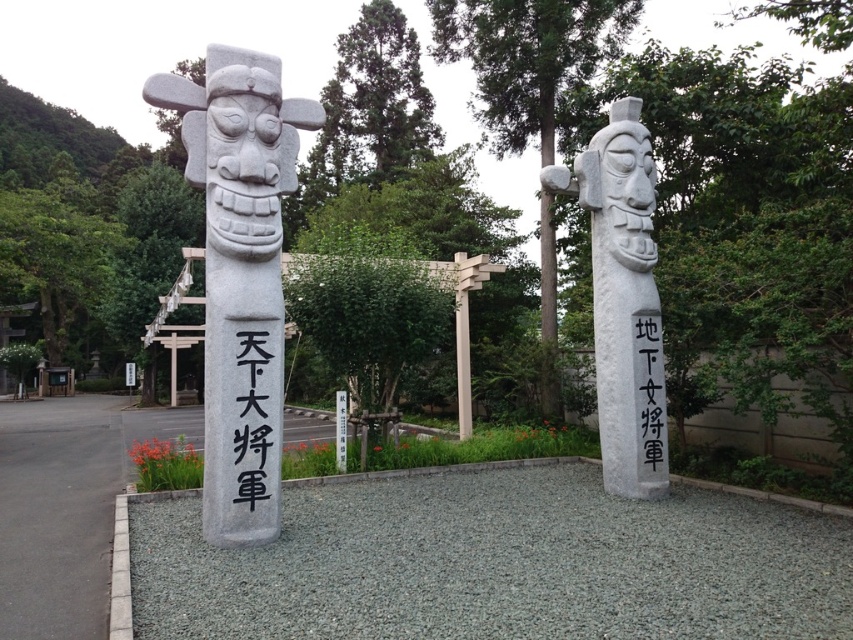
Does gray gravel at center appear on the left side of gray stone statue at left?

No, gray gravel at center is not to the left of gray stone statue at left.

Is point (512, 492) positioned in front of point (215, 257)?

That is False.

Describe the element at coordinates (498, 564) in the screenshot. The image size is (853, 640). I see `gray gravel at center` at that location.

This screenshot has height=640, width=853. What are the coordinates of `gray gravel at center` in the screenshot? It's located at (498, 564).

Describe the element at coordinates (498, 564) in the screenshot. I see `gray gravel at center` at that location.

Which is above, gray gravel at center or black stone text at center?

black stone text at center is higher up.

Which is in front, point (402, 632) or point (247, 500)?

Point (402, 632)

Locate an element on the screen. Image resolution: width=853 pixels, height=640 pixels. gray gravel at center is located at coordinates (498, 564).

Does white stone statue at right have a greater height compared to white stone pillar at left?

Correct, white stone statue at right is much taller as white stone pillar at left.

Between white stone statue at right and white stone pillar at left, which one appears on the right side from the viewer's perspective?

Positioned to the right is white stone statue at right.

The height and width of the screenshot is (640, 853). What are the coordinates of `white stone statue at right` in the screenshot? It's located at (624, 300).